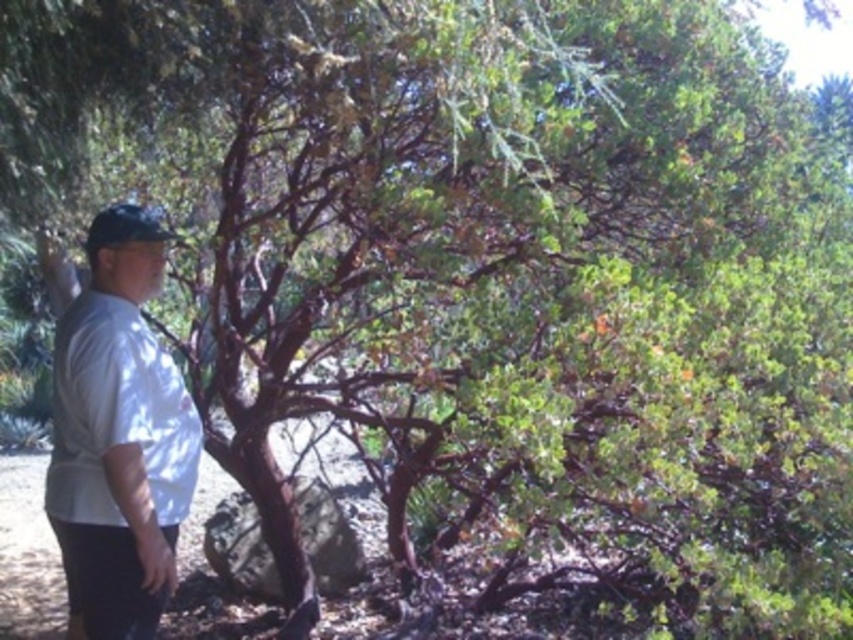
Question: Which point is closer to the camera?

Choices:
 (A) white cotton shirt at left
 (B) black matte baseball hat at left
 (C) white matte shirt at left

Answer: (C)

Question: Which object appears closest to the camera in this image?

Choices:
 (A) black matte baseball hat at left
 (B) white cotton shirt at left

Answer: (B)

Question: Is white cotton shirt at left positioned at the back of black matte baseball hat at left?

Choices:
 (A) no
 (B) yes

Answer: (A)

Question: Which object is positioned closest to the white cotton shirt at left?

Choices:
 (A) white matte shirt at left
 (B) black matte baseball hat at left

Answer: (A)

Question: Is white cotton shirt at left smaller than white matte shirt at left?

Choices:
 (A) yes
 (B) no

Answer: (B)

Question: Does white matte shirt at left appear under black matte baseball hat at left?

Choices:
 (A) yes
 (B) no

Answer: (A)